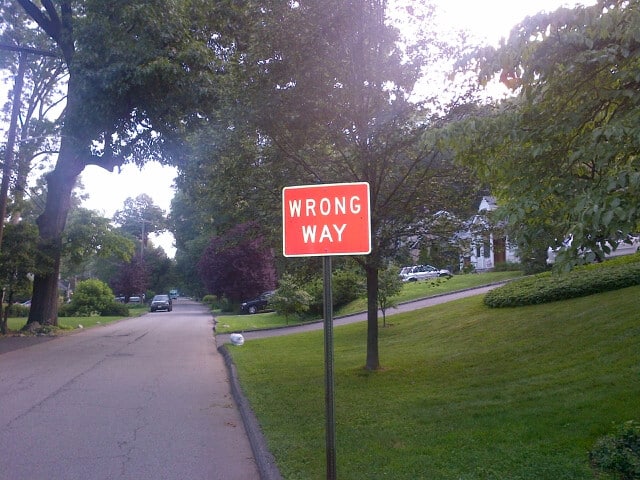
Where is `trash`? The width and height of the screenshot is (640, 480). trash is located at coordinates (240, 339).